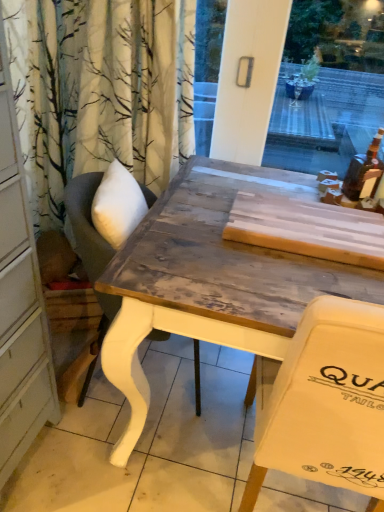
Question: From the image's perspective, is wooden table at center under translucent amber bottle at upper right?

Choices:
 (A) no
 (B) yes

Answer: (B)

Question: Can you confirm if wooden table at center is thinner than translucent amber bottle at upper right?

Choices:
 (A) yes
 (B) no

Answer: (B)

Question: Is wooden table at center facing away from translucent amber bottle at upper right?

Choices:
 (A) no
 (B) yes

Answer: (A)

Question: Are wooden table at center and translucent amber bottle at upper right far apart?

Choices:
 (A) yes
 (B) no

Answer: (B)

Question: Can you confirm if wooden table at center is taller than translucent amber bottle at upper right?

Choices:
 (A) no
 (B) yes

Answer: (B)

Question: Can you confirm if wooden table at center is bigger than translucent amber bottle at upper right?

Choices:
 (A) yes
 (B) no

Answer: (A)

Question: Is translucent amber bottle at upper right smaller than wooden chair at center?

Choices:
 (A) yes
 (B) no

Answer: (A)

Question: Is translucent amber bottle at upper right to the right of wooden chair at center from the viewer's perspective?

Choices:
 (A) yes
 (B) no

Answer: (A)

Question: Does translucent amber bottle at upper right have a lesser height compared to wooden chair at center?

Choices:
 (A) no
 (B) yes

Answer: (B)

Question: Is translucent amber bottle at upper right wider than wooden chair at center?

Choices:
 (A) no
 (B) yes

Answer: (A)

Question: From a real-world perspective, is translucent amber bottle at upper right physically below wooden chair at center?

Choices:
 (A) yes
 (B) no

Answer: (B)

Question: Is wooden chair at center inside translucent amber bottle at upper right?

Choices:
 (A) yes
 (B) no

Answer: (B)

Question: Would you say wooden chair at center is part of wooden table at center's contents?

Choices:
 (A) no
 (B) yes

Answer: (A)